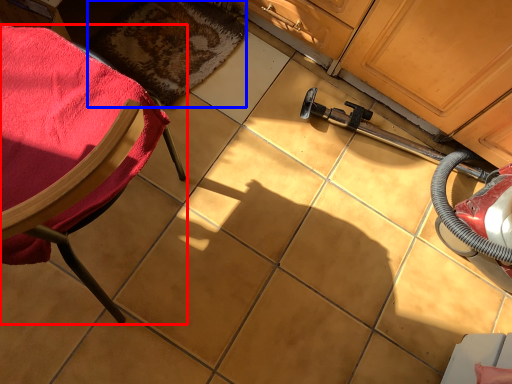
Question: Among these objects, which one is farthest to the camera, chair (highlighted by a red box) or mat (highlighted by a blue box)?

Choices:
 (A) chair
 (B) mat

Answer: (B)